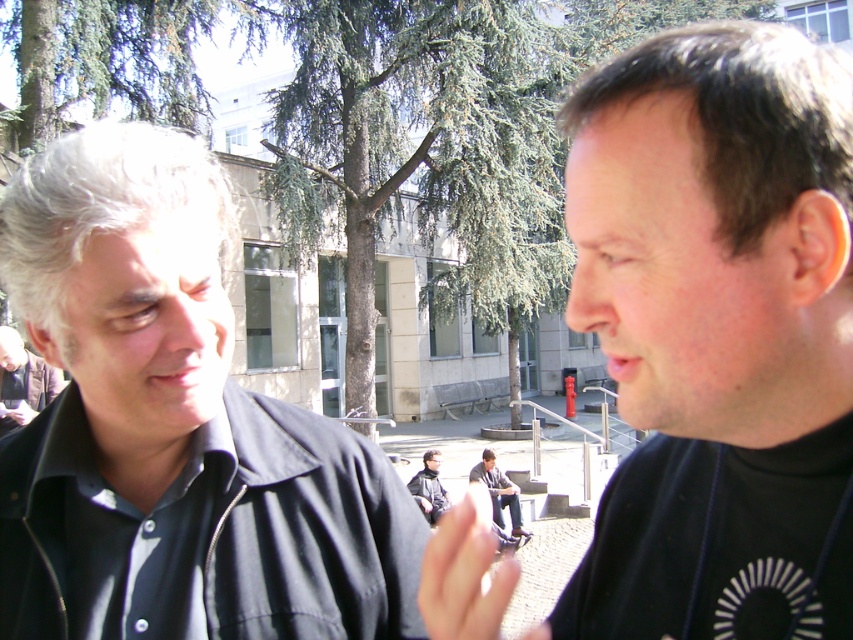
Between black matte shirt at left and light brown leather jacket at left, which one has less height?

light brown leather jacket at left is shorter.

Which is behind, point (387, 497) or point (6, 324)?

The point (6, 324) is more distant.

Locate an element on the screen. black matte shirt at left is located at coordinates (173, 428).

Does black matte shirt at left appear under dark gray jeans at center?

Actually, black matte shirt at left is above dark gray jeans at center.

Between black matte shirt at left and dark gray jeans at center, which one is positioned higher?

Positioned higher is black matte shirt at left.

The image size is (853, 640). Find the location of `black matte shirt at left`. black matte shirt at left is located at coordinates (173, 428).

Is point (633, 454) positioned in front of point (392, 534)?

Yes, point (633, 454) is closer to viewer.

Is point (735, 99) farther from camera compared to point (146, 547)?

No, it is in front of (146, 547).

The height and width of the screenshot is (640, 853). What are the coordinates of `black matte shirt at right` in the screenshot? It's located at (718, 333).